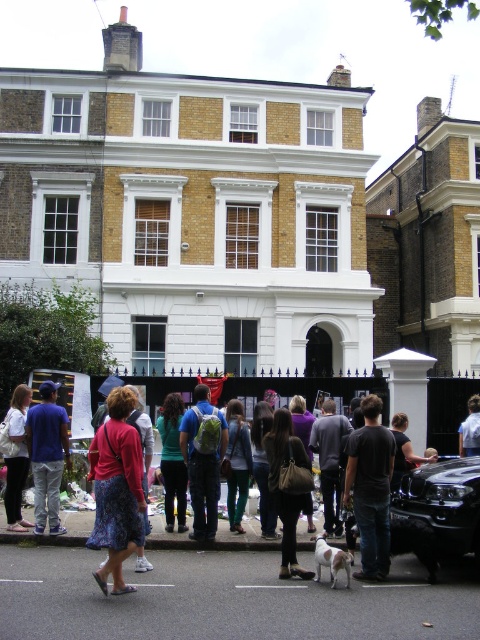
What is the color and type of the object located at the coordinates point (444, 502) in the image?

The object at point (444, 502) is a black glossy car at lower right.

You are a photographer standing in the street scene. You need to capture a photo that includes both the black glossy car at lower right and the black cotton shirt at center. Based on their positions, which object should be placed on the right side of the photo frame?

The black glossy car at lower right is to the right of the black cotton shirt at center, so to include both in the photo, the black glossy car at lower right should be placed on the right side of the photo frame.

You are a photographer standing in front of the building and want to capture both the floral skirt at center and the black glossy car at lower right in a single shot. Based on their positions, which object should you frame first to ensure both are included?

The floral skirt at center is to the left of the black glossy car at lower right, so you should frame the floral skirt at center first to ensure both are included in the shot.